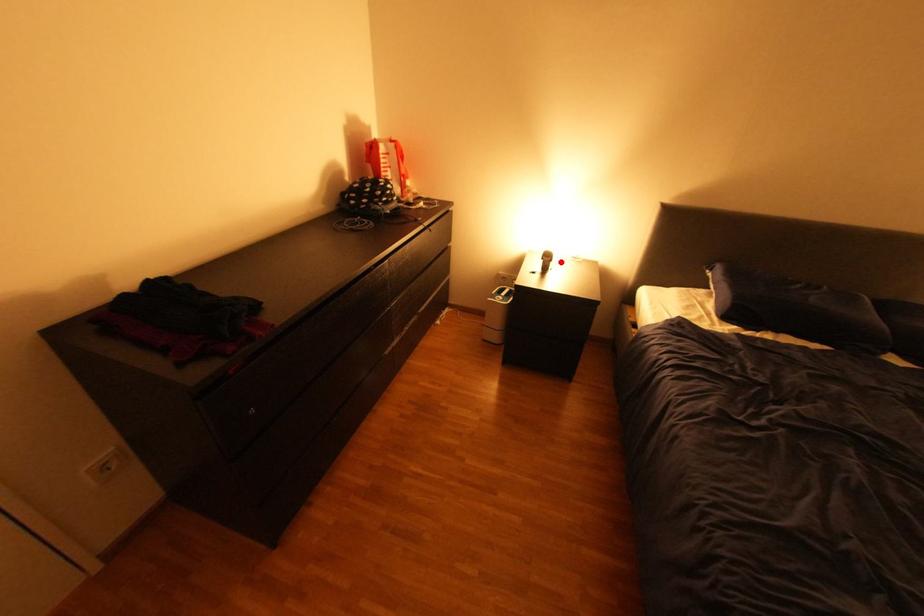
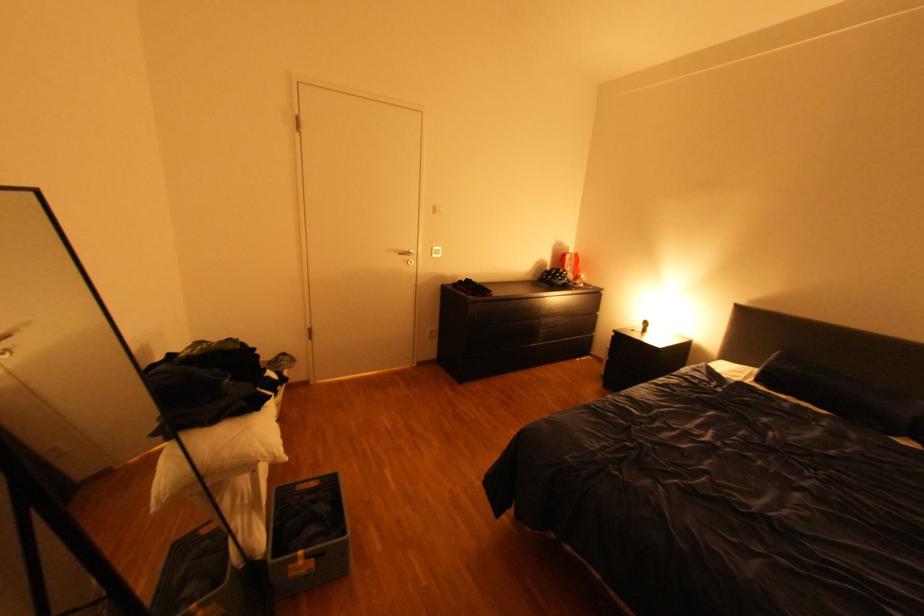
Find the pixel in the second image that matches the highlighted location in the first image.

(659, 328)